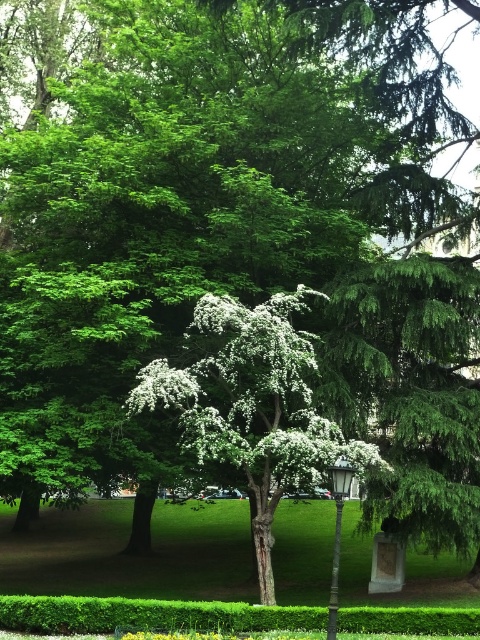
Question: Which object appears farthest from the camera in this image?

Choices:
 (A) white blossoming tree at center
 (B) metallic gray lamp post at center

Answer: (A)

Question: Is white blossoming tree at center thinner than metallic gray lamp post at center?

Choices:
 (A) no
 (B) yes

Answer: (A)

Question: Among these points, which one is farthest from the camera?

Choices:
 (A) click(x=340, y=464)
 (B) click(x=263, y=381)

Answer: (B)

Question: Observing the image, what is the correct spatial positioning of white blossoming tree at center in reference to metallic gray lamp post at center?

Choices:
 (A) left
 (B) right

Answer: (A)

Question: Does white blossoming tree at center appear over metallic gray lamp post at center?

Choices:
 (A) no
 (B) yes

Answer: (B)